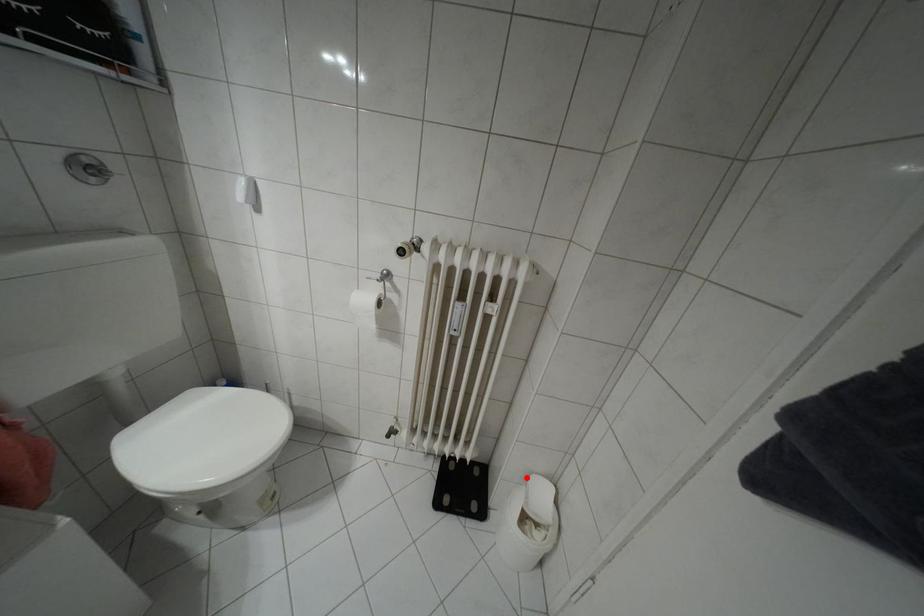
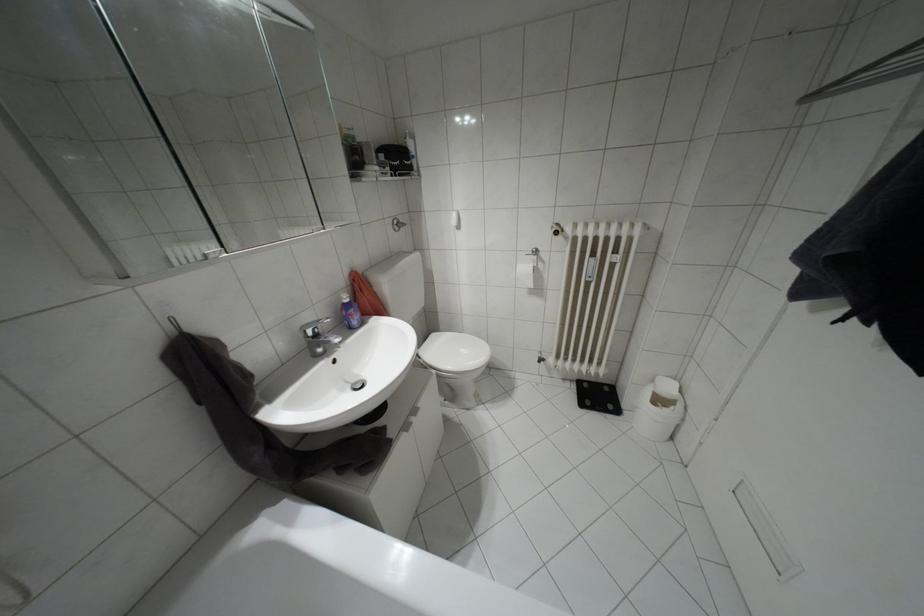
Find the pixel in the second image that matches the highlighted location in the first image.

(652, 379)